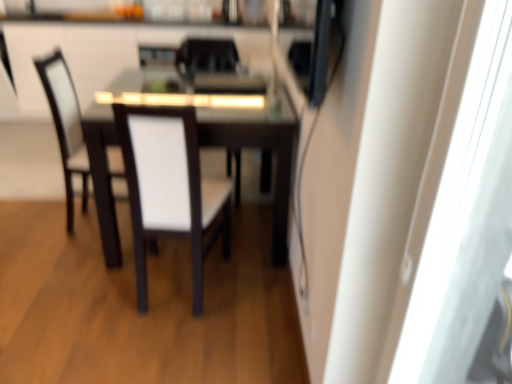
Question: From a real-world perspective, is white fabric chair at center, marked as the third chair in a back-to-front arrangement, physically below white fabric chair at center, the fourth chair from the back?

Choices:
 (A) no
 (B) yes

Answer: (A)

Question: Is white fabric chair at center, marked as the third chair in a back-to-front arrangement, far from white fabric chair at center, the fourth chair from the back?

Choices:
 (A) no
 (B) yes

Answer: (A)

Question: Can you confirm if white fabric chair at center, the 2th chair when ordered from front to back, is taller than white fabric chair at center, the fourth chair from the back?

Choices:
 (A) no
 (B) yes

Answer: (A)

Question: Is white fabric chair at center, marked as the third chair in a back-to-front arrangement, closer to the viewer compared to white fabric chair at center, the fourth chair from the back?

Choices:
 (A) no
 (B) yes

Answer: (A)

Question: Considering the relative sizes of white fabric chair at center, marked as the third chair in a back-to-front arrangement, and white fabric chair at center, which is the 1th chair from front to back, in the image provided, is white fabric chair at center, marked as the third chair in a back-to-front arrangement, shorter than white fabric chair at center, which is the 1th chair from front to back,?

Choices:
 (A) no
 (B) yes

Answer: (B)

Question: Is point (117, 77) closer or farther from the camera than point (70, 165)?

Choices:
 (A) farther
 (B) closer

Answer: (A)

Question: Do you think dark wood table at center is within white fabric chair at center, marked as the third chair in a back-to-front arrangement, or outside of it?

Choices:
 (A) inside
 (B) outside

Answer: (B)

Question: Would you say dark wood table at center is to the left or to the right of white fabric chair at center, marked as the third chair in a back-to-front arrangement, in the picture?

Choices:
 (A) right
 (B) left

Answer: (A)

Question: Considering the positions of dark wood table at center and white fabric chair at center, marked as the third chair in a back-to-front arrangement, in the image, is dark wood table at center bigger or smaller than white fabric chair at center, marked as the third chair in a back-to-front arrangement,?

Choices:
 (A) big
 (B) small

Answer: (A)

Question: From a real-world perspective, relative to white glossy cabinetry at upper center, is transparent plastic screen door at right vertically above or below?

Choices:
 (A) above
 (B) below

Answer: (A)

Question: From the image's perspective, is transparent plastic screen door at right above or below white glossy cabinetry at upper center?

Choices:
 (A) above
 (B) below

Answer: (B)

Question: Is transparent plastic screen door at right bigger or smaller than white glossy cabinetry at upper center?

Choices:
 (A) small
 (B) big

Answer: (A)

Question: Choose the correct answer: Is transparent plastic screen door at right inside white glossy cabinetry at upper center or outside it?

Choices:
 (A) outside
 (B) inside

Answer: (A)

Question: From the image's perspective, is white fabric chair at center, marked as the third chair in a back-to-front arrangement, positioned above or below white glossy cabinetry at upper center?

Choices:
 (A) above
 (B) below

Answer: (B)

Question: Which is correct: white fabric chair at center, the 2th chair when ordered from front to back, is inside white glossy cabinetry at upper center, or outside of it?

Choices:
 (A) inside
 (B) outside

Answer: (B)